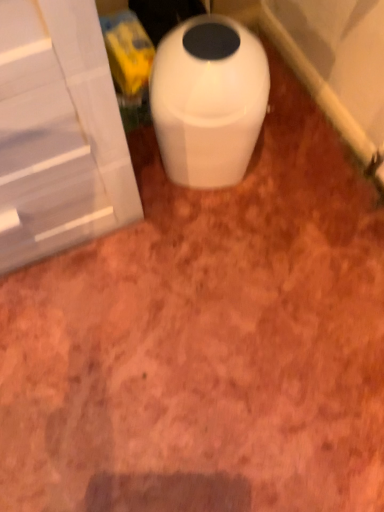
Question: Looking at the image, does white glossy trash can at center seem bigger or smaller compared to white glossy screen door at left?

Choices:
 (A) big
 (B) small

Answer: (B)

Question: From the image's perspective, is white glossy trash can at center located above or below white glossy screen door at left?

Choices:
 (A) below
 (B) above

Answer: (A)

Question: Considering the positions of white glossy trash can at center and white glossy screen door at left in the image, is white glossy trash can at center taller or shorter than white glossy screen door at left?

Choices:
 (A) tall
 (B) short

Answer: (B)

Question: Is point (124, 132) closer or farther from the camera than point (225, 128)?

Choices:
 (A) farther
 (B) closer

Answer: (A)

Question: From a real-world perspective, relative to white glossy trash can at center, is white glossy screen door at left vertically above or below?

Choices:
 (A) below
 (B) above

Answer: (B)

Question: Considering the relative positions of white glossy screen door at left and white glossy trash can at center in the image provided, is white glossy screen door at left to the left or to the right of white glossy trash can at center?

Choices:
 (A) right
 (B) left

Answer: (B)

Question: Looking at the image, does white glossy screen door at left seem bigger or smaller compared to white glossy trash can at center?

Choices:
 (A) small
 (B) big

Answer: (B)